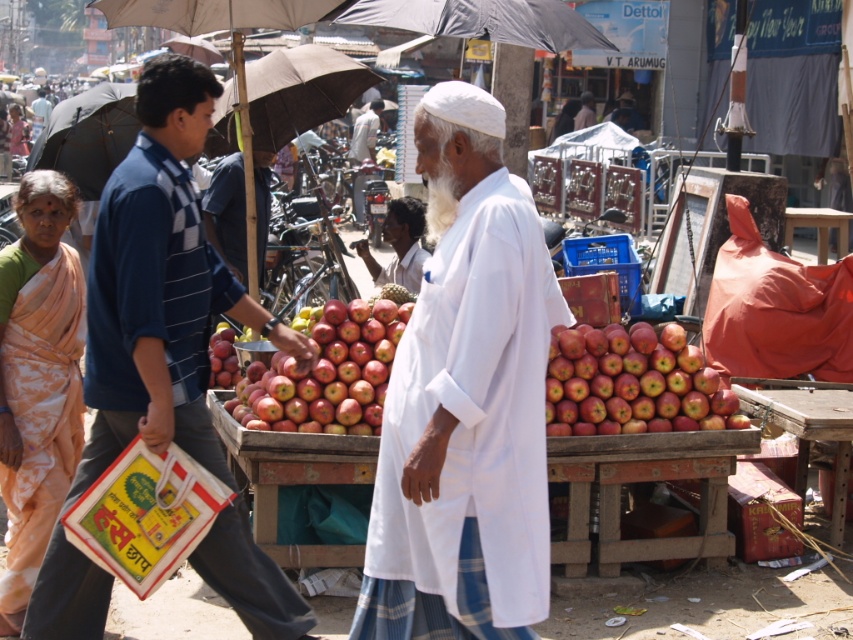
Can you confirm if white cotton robe at center is thinner than dark skin textured face at center?

No.

Does white cotton robe at center come behind dark skin textured face at center?

No.

Describe the element at coordinates (465, 401) in the screenshot. I see `white cotton robe at center` at that location.

You are a GUI agent. You are given a task and a screenshot of the screen. Output one action in this format:
    pyautogui.click(x=<x>, y=<y>)
    Task: Click on the white cotton robe at center
    The width and height of the screenshot is (853, 640).
    Given the screenshot: What is the action you would take?
    pyautogui.click(x=465, y=401)

Is point (123, 333) positioned after point (583, 29)?

No, (123, 333) is in front of (583, 29).

Does matte white apples at center have a greater width compared to black matte umbrella at upper center?

No, matte white apples at center is not wider than black matte umbrella at upper center.

What do you see at coordinates (160, 285) in the screenshot? I see `matte white apples at center` at bounding box center [160, 285].

Where is `matte white apples at center`? The image size is (853, 640). matte white apples at center is located at coordinates (160, 285).

Is point (209, 419) positioned before point (358, 220)?

Yes, point (209, 419) is in front of point (358, 220).

Which is behind, point (202, 541) or point (358, 122)?

Positioned behind is point (358, 122).

I want to click on matte white apples at center, so click(x=160, y=285).